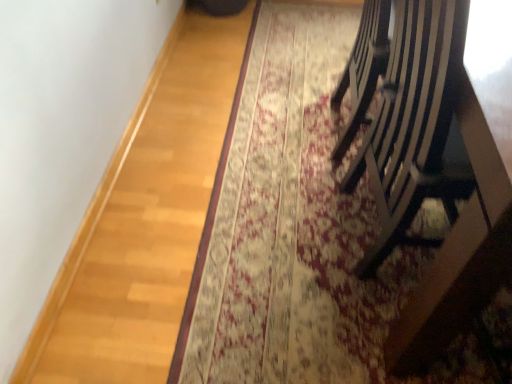
Measure the distance between point (404, 339) and camera.

Point (404, 339) is 3.36 feet away from camera.

This screenshot has height=384, width=512. What do you see at coordinates (426, 168) in the screenshot?
I see `black wood chair at right` at bounding box center [426, 168].

You are a GUI agent. You are given a task and a screenshot of the screen. Output one action in this format:
    pyautogui.click(x=<x>, y=<y>)
    Task: Click on the black wood chair at right
    This screenshot has width=512, height=384.
    Given the screenshot: What is the action you would take?
    pos(426,168)

This screenshot has height=384, width=512. What are the coordinates of `black wood chair at right` in the screenshot? It's located at (426, 168).